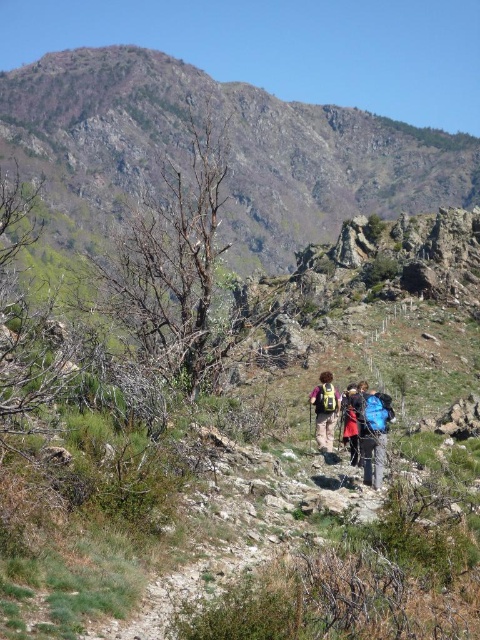
Question: Is blue fabric backpack at center below red fabric backpack at center?

Choices:
 (A) yes
 (B) no

Answer: (B)

Question: Does rugged rock mountain at center appear on the left side of yellow backpack at center?

Choices:
 (A) yes
 (B) no

Answer: (A)

Question: Based on their relative distances, which object is nearer to the rugged rock mountain at center?

Choices:
 (A) blue fabric backpack at center
 (B) yellow backpack at center

Answer: (B)

Question: Based on their relative distances, which object is farther from the blue fabric backpack at center?

Choices:
 (A) red fabric backpack at center
 (B) rugged rock mountain at center

Answer: (B)

Question: Is yellow backpack at center positioned in front of red fabric backpack at center?

Choices:
 (A) no
 (B) yes

Answer: (A)

Question: Which point is farther to the camera?

Choices:
 (A) rugged rock mountain at center
 (B) red fabric backpack at center
 (C) yellow backpack at center

Answer: (A)